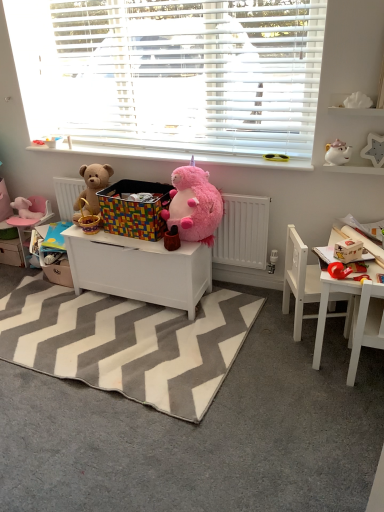
Locate an element on the screen. The image size is (384, 512). vacant area on top of white plastic sunglasses at upper center (from a real-world perspective) is located at coordinates (172, 152).